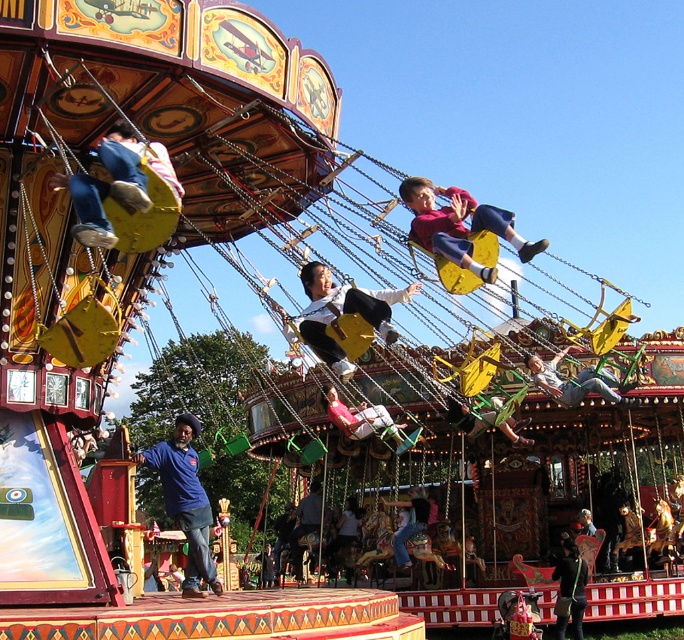
Question: Which object is positioned farthest from the yellow fabric swing at center?

Choices:
 (A) light pink fabric at center
 (B) matte blue jeans at left

Answer: (A)

Question: Is blue denim jeans at center to the left of light brown wooden swing at center from the viewer's perspective?

Choices:
 (A) yes
 (B) no

Answer: (A)

Question: Is yellow fabric swing at center positioned at the back of green fabric swing at center?

Choices:
 (A) no
 (B) yes

Answer: (A)

Question: Does matte yellow swing at center have a smaller size compared to green fabric swing at center?

Choices:
 (A) no
 (B) yes

Answer: (B)

Question: Estimate the real-world distances between objects in this image. Which object is closer to the matte yellow swing at center?

Choices:
 (A) light brown wooden swing at center
 (B) dark blue fabric jacket at center
 (C) yellow fabric swing at center
 (D) matte blue jeans at left

Answer: (C)

Question: Which of the following is the closest to the observer?

Choices:
 (A) (466, 432)
 (B) (552, 376)
 (C) (399, 552)

Answer: (B)